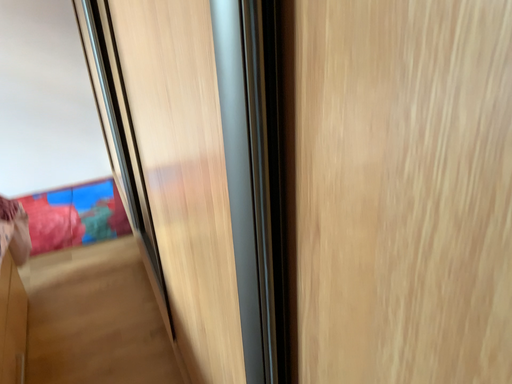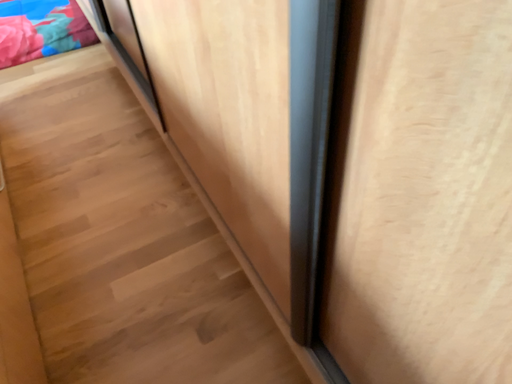
Question: How did the camera likely rotate when shooting the video?

Choices:
 (A) rotated upward
 (B) rotated downward

Answer: (B)